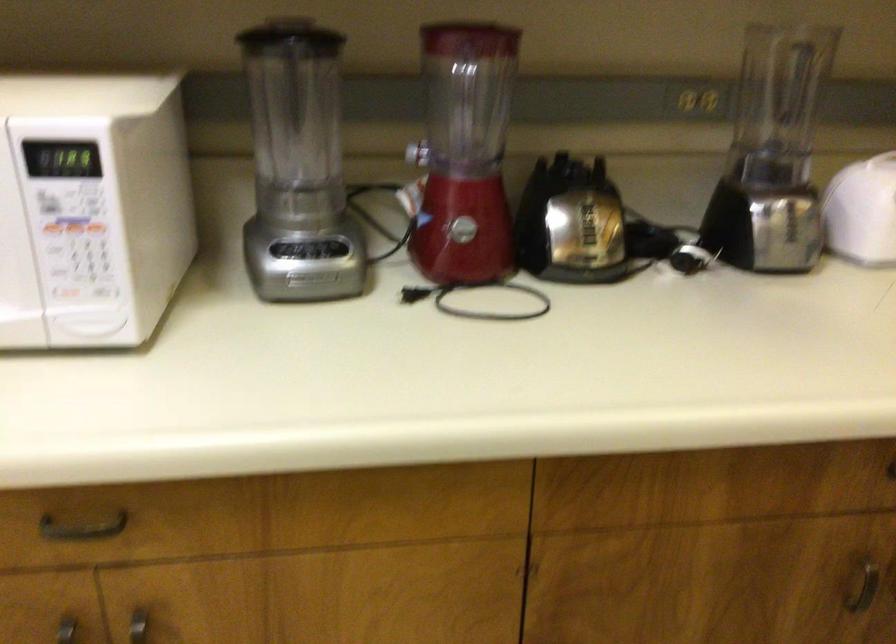
Where is `white microwave handle`? white microwave handle is located at coordinates (136, 93).